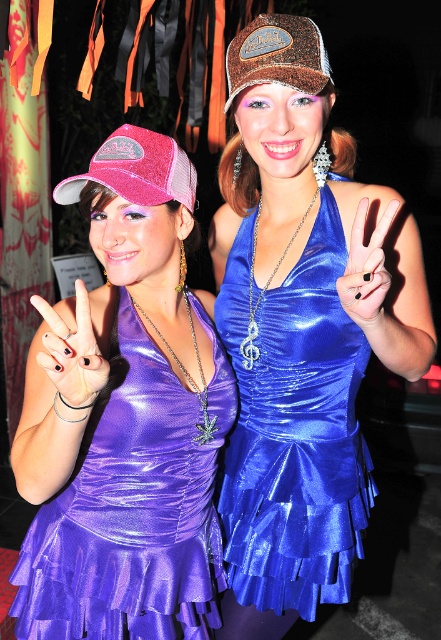
You are a photographer setting up for a group photo. The scene has a glittery brown cap at upper center and a black matte hand at center. You need to ensure there is at least 12 inches of space between these two elements to avoid overlapping in the photo. Based on the scene description, will the current spacing meet your requirement?

The glittery brown cap at upper center and black matte hand at center are 13.58 inches apart, which is more than the required 12 inches. Therefore, the spacing meets the requirement and they will not overlap in the photo.

You are a photographer trying to capture the perfect shot of the glittery brown cap at upper center and the black matte hand at center. Since you want to focus on the cap, which object should you zoom in on more, and why?

You should zoom in more on the glittery brown cap at upper center because its width is greater than the black matte hand at center, making it a larger subject to focus on.